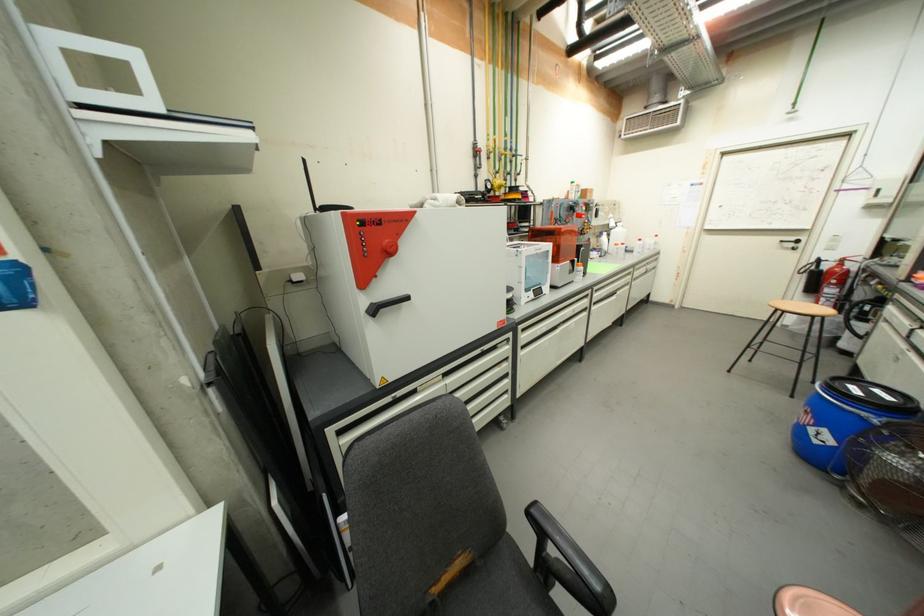
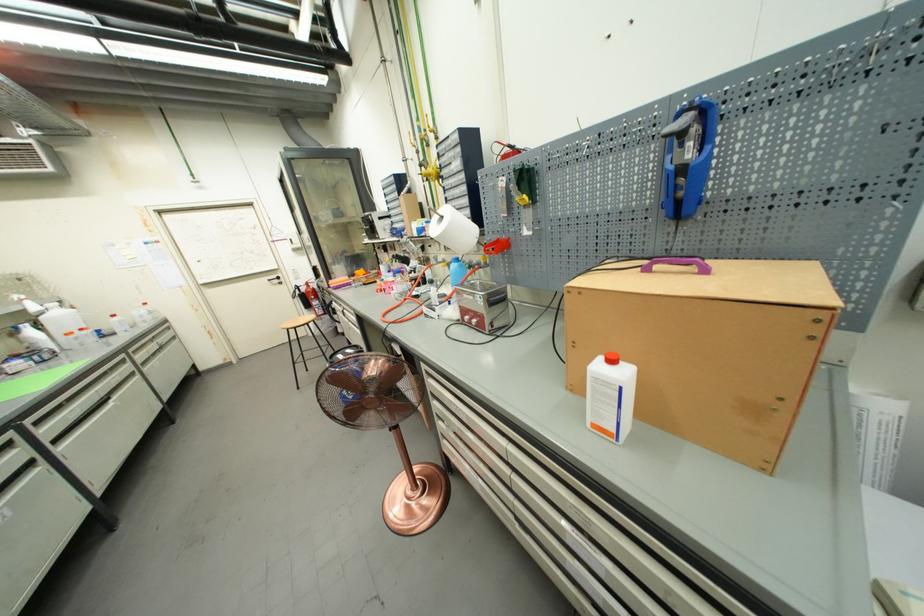
In the second image, find the point that corresponds to [832,268] in the first image.

(309, 291)